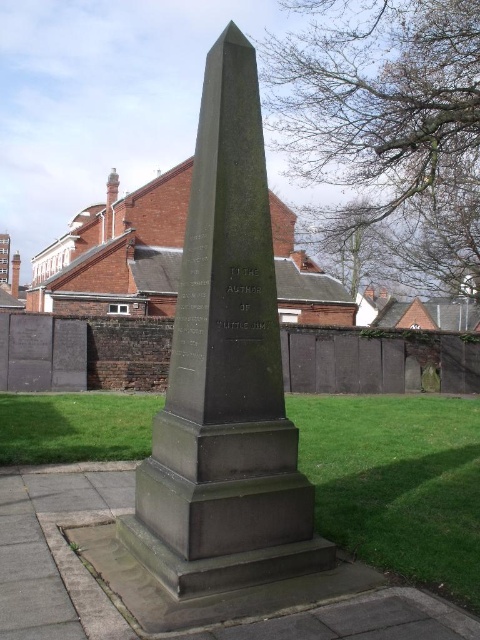
Question: Is dark gray stone obelisk at center above green grass at center?

Choices:
 (A) yes
 (B) no

Answer: (A)

Question: Which object appears closest to the camera in this image?

Choices:
 (A) green grass at center
 (B) dark gray stone obelisk at center

Answer: (A)

Question: Which point appears closest to the camera in this image?

Choices:
 (A) (264, 163)
 (B) (52, 397)

Answer: (A)

Question: Is dark gray stone obelisk at center to the left of green grass at center from the viewer's perspective?

Choices:
 (A) yes
 (B) no

Answer: (A)

Question: Is dark gray stone obelisk at center bigger than green grass at center?

Choices:
 (A) no
 (B) yes

Answer: (A)